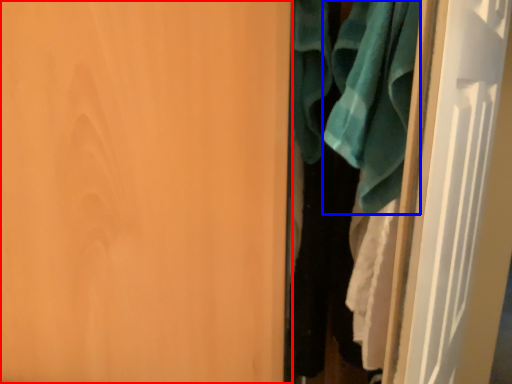
Question: Which of the following is the closest to the observer, door (highlighted by a red box) or bath towel (highlighted by a blue box)?

Choices:
 (A) door
 (B) bath towel

Answer: (A)